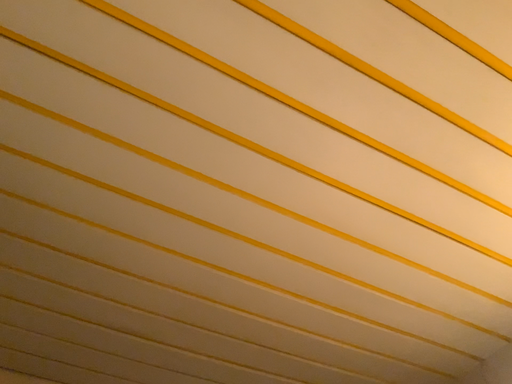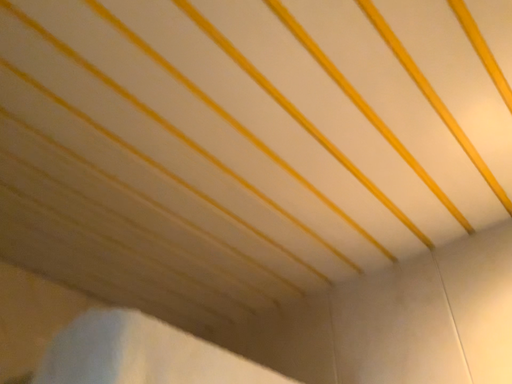
Question: How did the camera likely rotate when shooting the video?

Choices:
 (A) rotated upward
 (B) rotated downward

Answer: (B)